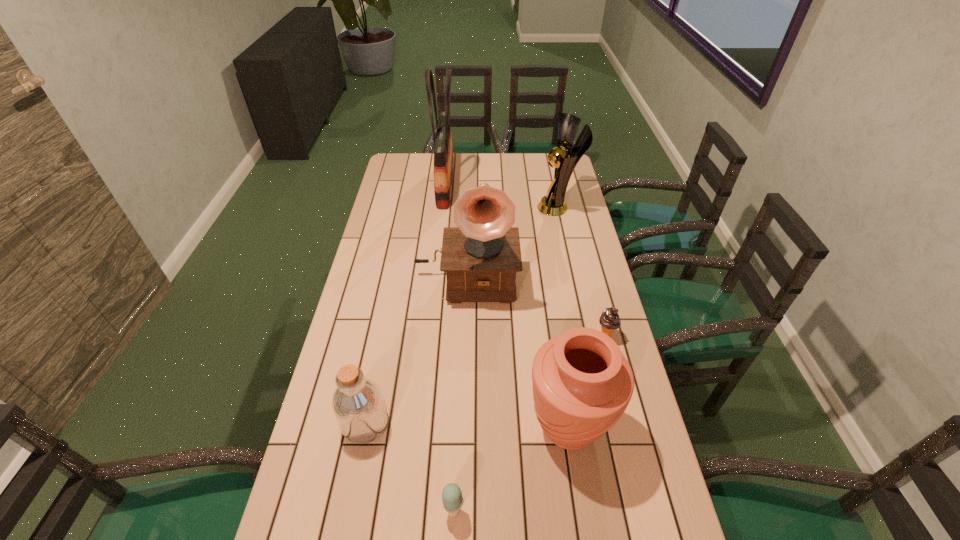
Image resolution: width=960 pixels, height=540 pixels. I want to click on vacant region located on the front-facing side of the shopping bag, so click(x=492, y=186).

I want to click on vacant space located 0.150m on the horn of the record player, so click(465, 345).

I want to click on free location located 0.120m at the front of the award, where the globe is visible, so click(509, 207).

I want to click on vacant space situated at the front of the award, where the globe is visible, so click(520, 207).

Where is `vacant space located at the front of the award, where the globe is visible`? The width and height of the screenshot is (960, 540). vacant space located at the front of the award, where the globe is visible is located at coordinates (488, 207).

Identify the location of free space located on the left of the vase. The height and width of the screenshot is (540, 960). (460, 427).

Locate an element on the screen. free space located on the back of the bottle is located at coordinates (382, 341).

Locate an element on the screen. This screenshot has height=540, width=960. free location located 0.200m on the back of the fourth nearest object is located at coordinates (592, 283).

You are a GUI agent. You are given a task and a screenshot of the screen. Output one action in this format:
    pyautogui.click(x=<x>, y=<y>)
    Task: Click on the blank space located 0.330m on the back of the nearest object
    The width and height of the screenshot is (960, 540).
    Given the screenshot: What is the action you would take?
    pyautogui.click(x=459, y=377)

I want to click on object located in the far edge section of the desktop, so click(x=443, y=151).